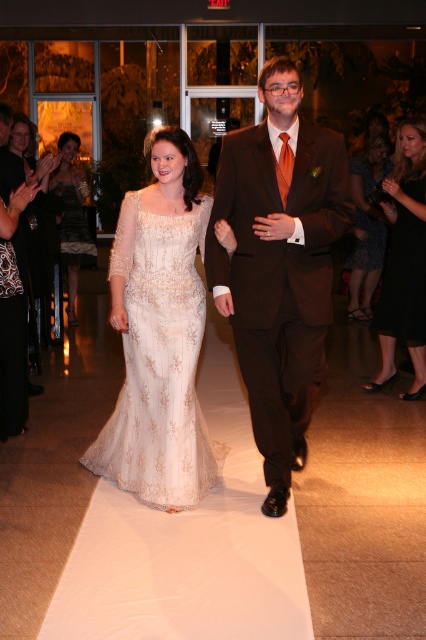
Question: Does ivory lace dress at center have a larger size compared to shiny gold dress at left?

Choices:
 (A) no
 (B) yes

Answer: (A)

Question: Observing the image, what is the correct spatial positioning of brown satin suit at center in reference to shiny gold dress at left?

Choices:
 (A) below
 (B) above

Answer: (A)

Question: Is black satin dress at lower right wider than printed fabric dress at right?

Choices:
 (A) no
 (B) yes

Answer: (A)

Question: Which of these objects is positioned farthest from the ivory lace dress at center?

Choices:
 (A) brown satin suit at center
 (B) shiny gold dress at left
 (C) printed fabric dress at right
 (D) white lace dress at center

Answer: (C)

Question: Which point is farther to the camera?

Choices:
 (A) [x=386, y=300]
 (B) [x=304, y=268]

Answer: (A)

Question: Which of the following is the farthest from the observer?

Choices:
 (A) black satin dress at lower right
 (B) shiny gold dress at left
 (C) brown satin suit at center

Answer: (B)